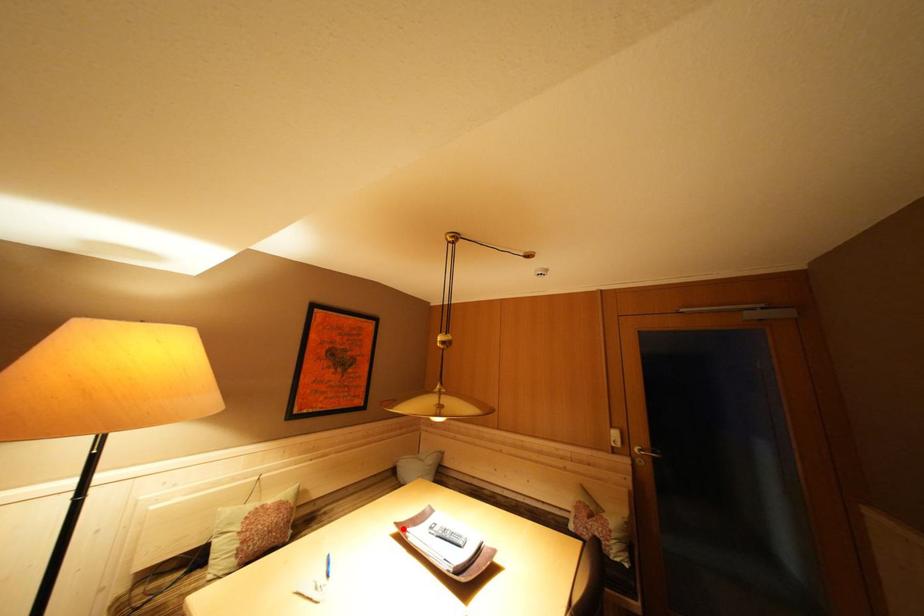
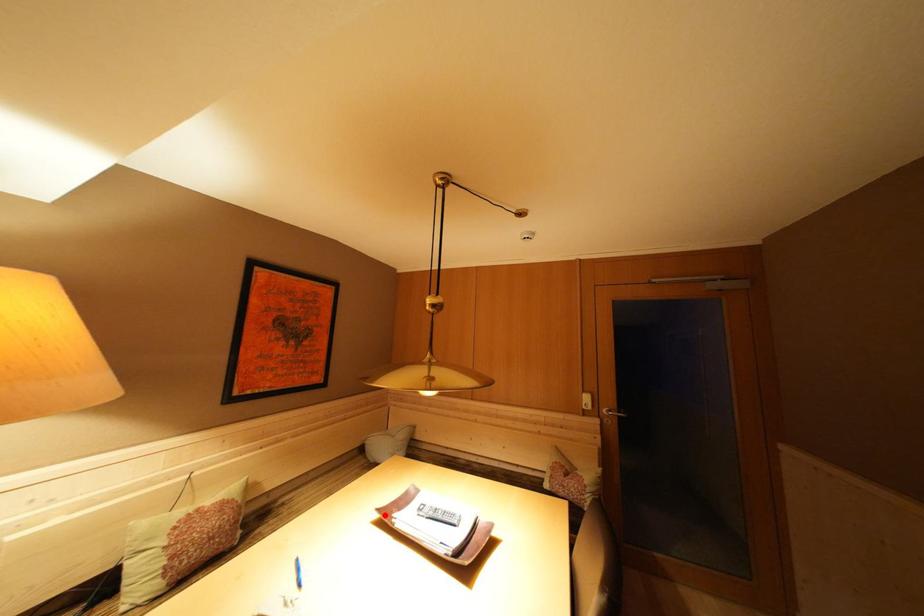
I am providing you with two images of the same scene from different viewpoints. A red point is marked on the first image and another point is marked on the second image. Is the marked point in image1 the same physical position as the marked point in image2?

Yes